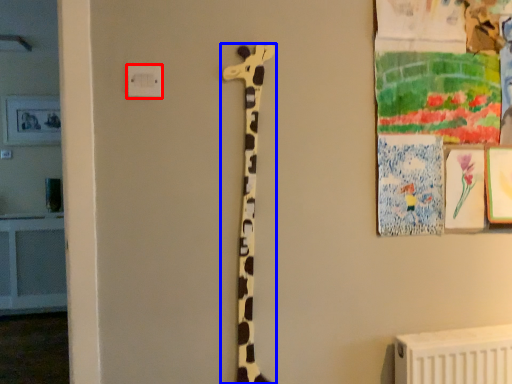
Question: Which object is closer to the camera taking this photo, electric outlet (highlighted by a red box) or giraffe (highlighted by a blue box)?

Choices:
 (A) electric outlet
 (B) giraffe

Answer: (A)